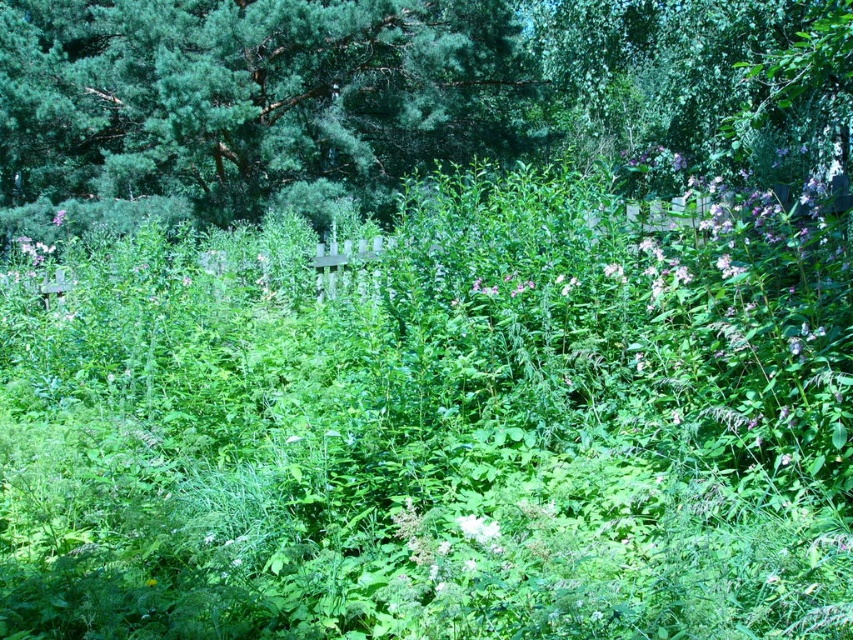
Does pink matte flower at center have a larger size compared to purple matte flower at upper left?

No, pink matte flower at center is not bigger than purple matte flower at upper left.

Measure the distance from pink matte flower at center to purple matte flower at upper left.

5.17 meters

This screenshot has width=853, height=640. Describe the element at coordinates (33, 250) in the screenshot. I see `pink matte flower at center` at that location.

Identify the location of pink matte flower at center. This screenshot has height=640, width=853. (33, 250).

Is green needle-like at upper center further to the viewer compared to pink matte flower at center?

No, it is in front of pink matte flower at center.

Who is taller, green needle-like at upper center or pink matte flower at center?

Standing taller between the two is green needle-like at upper center.

Image resolution: width=853 pixels, height=640 pixels. I want to click on green needle-like at upper center, so click(401, 99).

Which of these two, green needle-like at upper center or purple matte flower at upper left, stands taller?

Standing taller between the two is green needle-like at upper center.

Between point (590, 99) and point (55, 216), which one is positioned in front?

Point (590, 99) is in front.

The height and width of the screenshot is (640, 853). Identify the location of green needle-like at upper center. (401, 99).